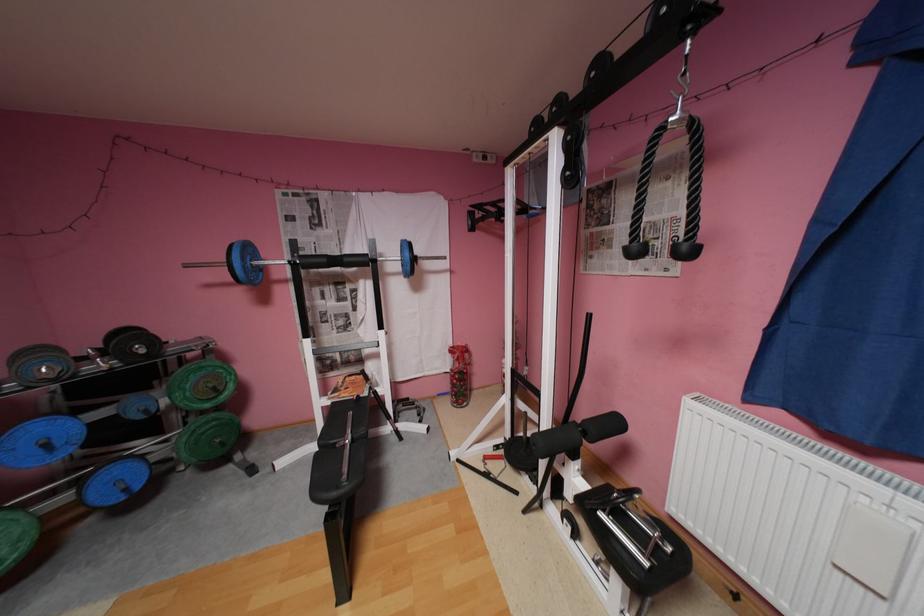
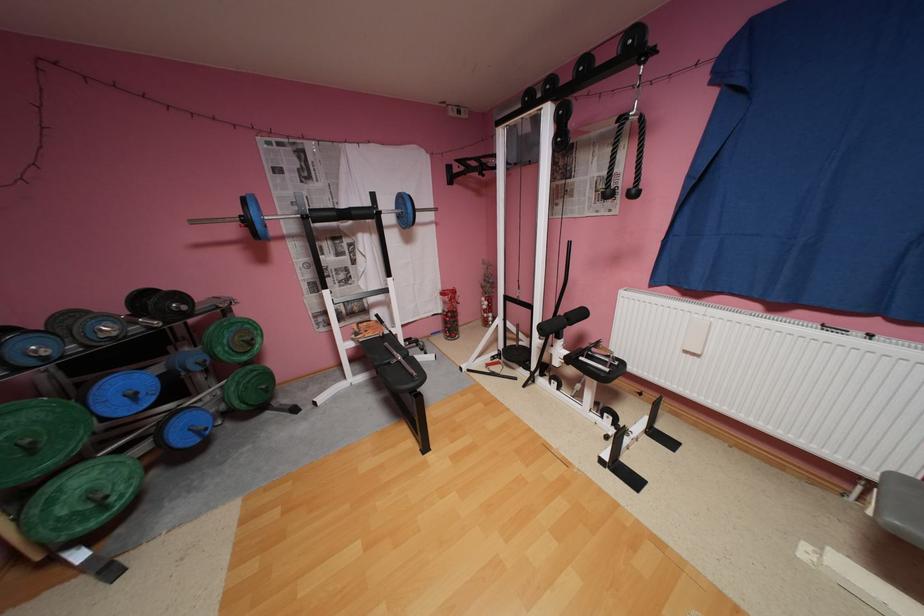
The point at (355, 395) is marked in the first image. Where is the corresponding point in the second image?

(380, 334)